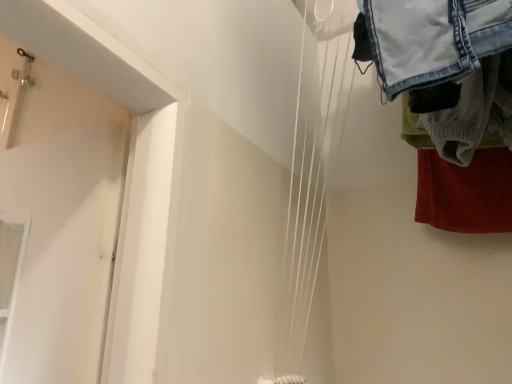
Locate an element on the screen. The image size is (512, 384). white matte wires at center is located at coordinates (312, 169).

Measure the distance between white matte wires at center and camera.

white matte wires at center is 32.51 inches from camera.

What is the approximate width of white matte wires at center?

The width of white matte wires at center is 5.82 inches.

Describe the element at coordinates (312, 169) in the screenshot. I see `white matte wires at center` at that location.

Locate an element on the screen. This screenshot has width=512, height=384. denim fabric laundry at upper right is located at coordinates (450, 102).

This screenshot has width=512, height=384. Describe the element at coordinates (450, 102) in the screenshot. I see `denim fabric laundry at upper right` at that location.

Where is `white matte wires at center`? The image size is (512, 384). white matte wires at center is located at coordinates (312, 169).

Can you confirm if white matte wires at center is positioned to the left of denim fabric laundry at upper right?

Indeed, white matte wires at center is positioned on the left side of denim fabric laundry at upper right.

Is white matte wires at center closer to the viewer compared to denim fabric laundry at upper right?

That is True.

Which is behind, point (322, 49) or point (451, 131)?

The point (322, 49) is farther from the camera.

From the image's perspective, is white matte wires at center located above or below denim fabric laundry at upper right?

white matte wires at center is below denim fabric laundry at upper right.

From a real-world perspective, is white matte wires at center on denim fabric laundry at upper right?

No, from a real-world perspective, white matte wires at center is not above denim fabric laundry at upper right.

Which of these two, white matte wires at center or denim fabric laundry at upper right, is wider?

With larger width is denim fabric laundry at upper right.

Is white matte wires at center shorter than denim fabric laundry at upper right?

No.

Does white matte wires at center have a larger size compared to denim fabric laundry at upper right?

No.

Is denim fabric laundry at upper right inside white matte wires at center?

No, denim fabric laundry at upper right is not inside white matte wires at center.

Is white matte wires at center directly adjacent to denim fabric laundry at upper right?

No, white matte wires at center is not next to denim fabric laundry at upper right.

Is white matte wires at center oriented away from denim fabric laundry at upper right?

No, white matte wires at center's orientation is not away from denim fabric laundry at upper right.

Measure the distance between white matte wires at center and denim fabric laundry at upper right.

The distance of white matte wires at center from denim fabric laundry at upper right is 30.92 centimeters.

Locate an element on the screen. The height and width of the screenshot is (384, 512). wire below the denim fabric laundry at upper right (from a real-world perspective) is located at coordinates (312, 169).

Is denim fabric laundry at upper right to the right of white matte wires at center from the viewer's perspective?

Yes.

Which is in front, denim fabric laundry at upper right or white matte wires at center?

Positioned in front is white matte wires at center.

Between point (448, 217) and point (298, 358), which one is positioned in front?

The point (298, 358) is closer to the camera.

From the image's perspective, is denim fabric laundry at upper right located above or below white matte wires at center?

denim fabric laundry at upper right is situated higher than white matte wires at center in the image.

From a real-world perspective, is denim fabric laundry at upper right physically located above or below white matte wires at center?

From a real-world perspective, denim fabric laundry at upper right is physically above white matte wires at center.

Looking at their sizes, would you say denim fabric laundry at upper right is wider or thinner than white matte wires at center?

Clearly, denim fabric laundry at upper right has more width compared to white matte wires at center.

Does denim fabric laundry at upper right have a lesser height compared to white matte wires at center?

Correct, denim fabric laundry at upper right is not as tall as white matte wires at center.

Considering the sizes of objects denim fabric laundry at upper right and white matte wires at center in the image provided, who is smaller, denim fabric laundry at upper right or white matte wires at center?

white matte wires at center is smaller.

Is denim fabric laundry at upper right surrounding white matte wires at center?

No, white matte wires at center is not a part of denim fabric laundry at upper right.

Is denim fabric laundry at upper right far from white matte wires at center?

That's not correct — denim fabric laundry at upper right is a little close to white matte wires at center.

Is denim fabric laundry at upper right facing away from white matte wires at center?

No.

How far apart are denim fabric laundry at upper right and white matte wires at center?

denim fabric laundry at upper right is 12.17 inches from white matte wires at center.

You are a GUI agent. You are given a task and a screenshot of the screen. Output one action in this format:
    pyautogui.click(x=<x>, y=<y>)
    Task: Click on the wire in front of the denim fabric laundry at upper right
    
    Given the screenshot: What is the action you would take?
    pyautogui.click(x=312, y=169)

What are the coordinates of `wire that appears below the denim fabric laundry at upper right (from a real-world perspective)` in the screenshot? It's located at (312, 169).

At what (x,y) coordinates should I click in order to perform the action: click on laundry lying on the right of white matte wires at center. Please return your answer as a coordinate pair (x, y). The width and height of the screenshot is (512, 384). Looking at the image, I should click on (450, 102).